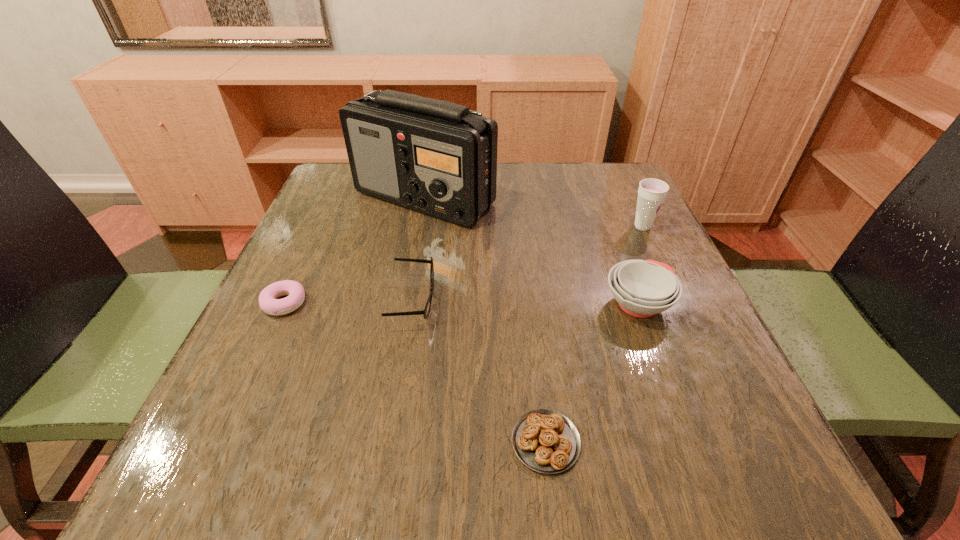
Locate an element on the screen. Image resolution: width=960 pixels, height=540 pixels. the tallest object is located at coordinates (439, 158).

This screenshot has height=540, width=960. What are the coordinates of `the second tallest object` in the screenshot? It's located at (651, 193).

Identify the location of soup bowl. (642, 288).

This screenshot has width=960, height=540. I want to click on the fourth tallest object, so 426,311.

Locate an element on the screen. This screenshot has width=960, height=540. the left pastry is located at coordinates (268, 301).

Where is `the farther pastry`? the farther pastry is located at coordinates (268, 301).

At what (x,y) coordinates should I click in order to perform the action: click on the right pastry. Please return your answer as a coordinate pair (x, y). Looking at the image, I should click on (546, 441).

Identify the location of the third object from right to left. (546, 441).

Identify the location of vacant region located 0.170m on the front panel of the radio receiver. The image size is (960, 540). (410, 281).

Locate an element on the screen. The image size is (960, 540). free space located 0.250m on the back of the cup is located at coordinates (614, 167).